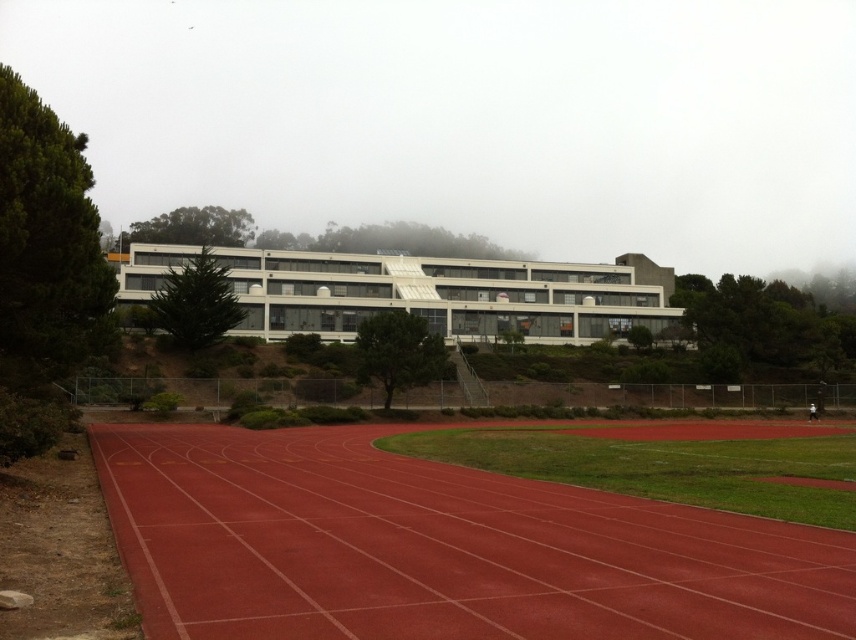
Who is positioned more to the right, rubber running track at center or white matte building at center?

Positioned to the right is white matte building at center.

Does rubber running track at center have a greater height compared to white matte building at center?

No.

Is point (486, 480) in front of point (336, 289)?

Yes.

Where is `rubber running track at center`? Image resolution: width=856 pixels, height=640 pixels. rubber running track at center is located at coordinates (438, 548).